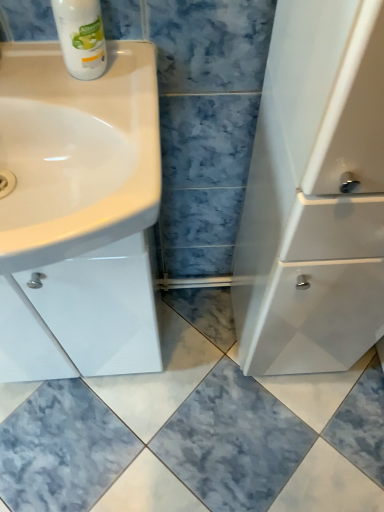
This screenshot has width=384, height=512. Identify the location of white glossy sink at left. (76, 152).

What do you see at coordinates (76, 152) in the screenshot?
I see `white glossy sink at left` at bounding box center [76, 152].

What do you see at coordinates (81, 37) in the screenshot? I see `white glossy bottle at upper left` at bounding box center [81, 37].

Find the location of a particular element. The height and width of the screenshot is (512, 384). white glossy bottle at upper left is located at coordinates (81, 37).

The width and height of the screenshot is (384, 512). What are the coordinates of `white glossy sink at left` in the screenshot? It's located at (76, 152).

Which is more to the left, white glossy bottle at upper left or white glossy sink at left?

Positioned to the left is white glossy sink at left.

Which object is more forward, white glossy bottle at upper left or white glossy sink at left?

white glossy sink at left is more forward.

Is point (96, 17) closer or farther from the camera than point (12, 250)?

Point (96, 17) is positioned farther from the camera compared to point (12, 250).

From the image's perspective, is white glossy bottle at upper left above or below white glossy sink at left?

white glossy bottle at upper left is situated higher than white glossy sink at left in the image.

From a real-world perspective, which object rests below the other?

In real-world perspective, white glossy sink at left is lower.

Considering the sizes of objects white glossy bottle at upper left and white glossy sink at left in the image provided, who is thinner, white glossy bottle at upper left or white glossy sink at left?

With smaller width is white glossy bottle at upper left.

Considering the relative sizes of white glossy bottle at upper left and white glossy sink at left in the image provided, is white glossy bottle at upper left taller than white glossy sink at left?

Indeed, white glossy bottle at upper left has a greater height compared to white glossy sink at left.

Considering the sizes of objects white glossy bottle at upper left and white glossy sink at left in the image provided, who is smaller, white glossy bottle at upper left or white glossy sink at left?

With smaller size is white glossy bottle at upper left.

Is white glossy bottle at upper left completely or partially outside of white glossy sink at left?

Yes, white glossy bottle at upper left is outside of white glossy sink at left.

In the scene shown: Are white glossy bottle at upper left and white glossy sink at left beside each other?

No.

Is white glossy bottle at upper left facing away from white glossy sink at left?

No, white glossy bottle at upper left is not facing away from white glossy sink at left.

What's the angular difference between white glossy bottle at upper left and white glossy sink at left's facing directions?

The facing directions of white glossy bottle at upper left and white glossy sink at left are 0.143 degrees apart.

How distant is white glossy bottle at upper left from white glossy sink at left?

The distance of white glossy bottle at upper left from white glossy sink at left is 13.45 centimeters.

Find the location of a particular element. The height and width of the screenshot is (512, 384). cleaning product that is above the white glossy sink at left (from a real-world perspective) is located at coordinates (81, 37).

Does white glossy sink at left appear on the right side of white glossy bottle at upper left?

No.

Is white glossy sink at left positioned in front of white glossy bottle at upper left?

That is True.

Is point (118, 216) closer to camera compared to point (78, 58)?

Yes, it is.

From the image's perspective, between white glossy sink at left and white glossy bottle at upper left, who is located below?

white glossy sink at left, from the image's perspective.

From a real-world perspective, is white glossy sink at left below white glossy bottle at upper left?

Yes, from a real-world perspective, white glossy sink at left is beneath white glossy bottle at upper left.

Which of these two, white glossy sink at left or white glossy bottle at upper left, is wider?

With larger width is white glossy sink at left.

Does white glossy sink at left have a greater height compared to white glossy bottle at upper left?

Incorrect, the height of white glossy sink at left is not larger of that of white glossy bottle at upper left.

Can you confirm if white glossy sink at left is bigger than white glossy bottle at upper left?

Yes, white glossy sink at left is bigger than white glossy bottle at upper left.

Can we say white glossy sink at left lies outside white glossy bottle at upper left?

white glossy sink at left is positioned outside white glossy bottle at upper left.

Are white glossy sink at left and white glossy bottle at upper left located far from each other?

No, white glossy sink at left is in close proximity to white glossy bottle at upper left.

Is white glossy sink at left aimed at white glossy bottle at upper left?

No, white glossy sink at left is not facing towards white glossy bottle at upper left.

How many degrees apart are the facing directions of white glossy sink at left and white glossy bottle at upper left?

The facing directions of white glossy sink at left and white glossy bottle at upper left are 0.143 degrees apart.

You are a GUI agent. You are given a task and a screenshot of the screen. Output one action in this format:
    pyautogui.click(x=<x>, y=<y>)
    Task: Click on the sink on the left of white glossy bottle at upper left
    The width and height of the screenshot is (384, 512).
    Given the screenshot: What is the action you would take?
    pyautogui.click(x=76, y=152)

In order to click on cleaning product behind the white glossy sink at left in this screenshot , I will do [x=81, y=37].

The width and height of the screenshot is (384, 512). Find the location of `sink in front of the white glossy bottle at upper left`. sink in front of the white glossy bottle at upper left is located at coordinates (76, 152).